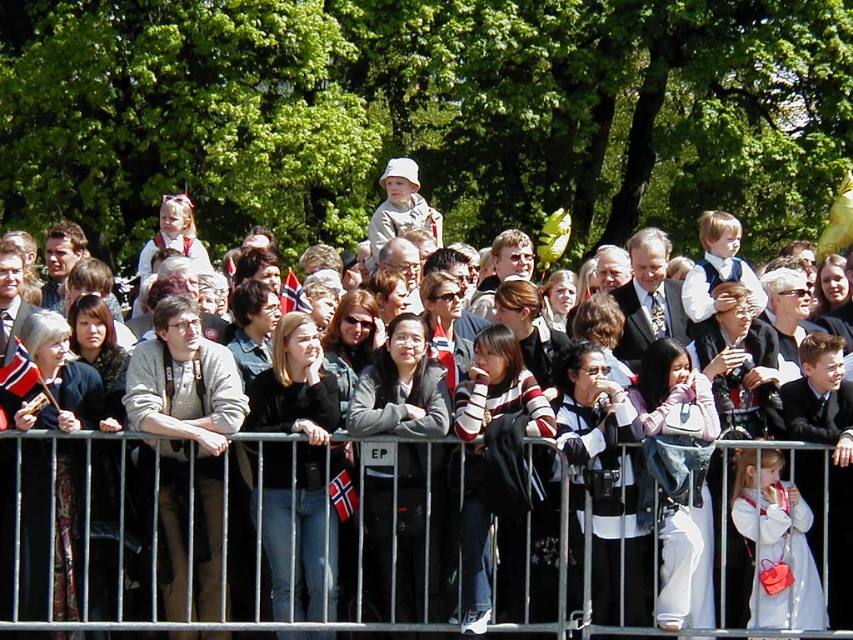
You are a photographer trying to capture a photo of the matte black jacket at center and the metallic silver fence at center. If you want to ensure both objects are fully visible in the frame, which object should you focus on first considering their widths?

The matte black jacket at center is wider than the metallic silver fence at center. To ensure both are fully visible, focus on the wider object first, which is the matte black jacket at center, then adjust the frame to include the metallic silver fence at center.

In the scene shown: You are a photographer standing at the edge of the crowd. You want to take a photo of the metallic silver fence at center without any people blocking it. The matte black jacket at center is currently in the way. Can you adjust your position to capture the fence without the jacket blocking it, considering their heights?

The matte black jacket at center is taller than the metallic silver fence at center. Since the jacket is blocking the view, moving to a lower angle or position might allow you to see under the jacket and capture the fence without obstruction.

You are a photographer standing in the crowd at the event. You want to take a photo that includes both the point at coordinates point [184,385] and point [587,509]. Considering their positions relative to you, which point should you focus on first to ensure both are in focus?

You should focus on point [184,385] first because it is closer to you than point [587,509], so focusing on the closer point will help ensure both are in focus.